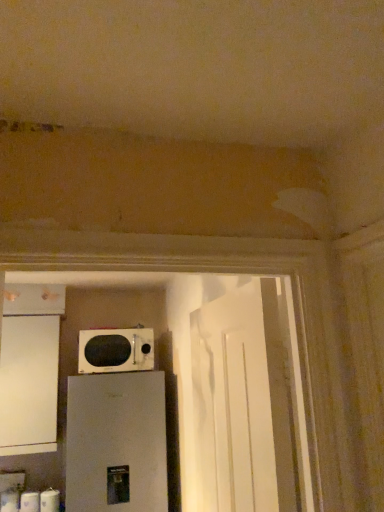
Question: Is white glossy microwave at center facing towards white matte toilet paper at lower left, which is the second toilet paper in left-to-right order?

Choices:
 (A) no
 (B) yes

Answer: (A)

Question: Does white glossy microwave at center have a lesser width compared to white matte toilet paper at lower left, the 2th toilet paper in the right-to-left sequence?

Choices:
 (A) yes
 (B) no

Answer: (B)

Question: Is white matte toilet paper at lower left, which is the second toilet paper in left-to-right order, a part of white glossy microwave at center?

Choices:
 (A) no
 (B) yes

Answer: (A)

Question: Does white glossy microwave at center have a greater width compared to white matte toilet paper at lower left, the 2th toilet paper in the right-to-left sequence?

Choices:
 (A) yes
 (B) no

Answer: (A)

Question: From the image's perspective, would you say white glossy microwave at center is shown under white matte toilet paper at lower left, the 2th toilet paper in the right-to-left sequence?

Choices:
 (A) yes
 (B) no

Answer: (B)

Question: From their relative heights in the image, would you say white matte toilet paper at lower left, which ranks as the third toilet paper in right-to-left order, is taller or shorter than white matte toilet paper at lower left, positioned as the 3th toilet paper in left-to-right order?

Choices:
 (A) tall
 (B) short

Answer: (A)

Question: Considering the positions of white matte toilet paper at lower left, which ranks as the third toilet paper in right-to-left order, and white matte toilet paper at lower left, positioned as the 3th toilet paper in left-to-right order, in the image, is white matte toilet paper at lower left, which ranks as the third toilet paper in right-to-left order, bigger or smaller than white matte toilet paper at lower left, positioned as the 3th toilet paper in left-to-right order,?

Choices:
 (A) small
 (B) big

Answer: (B)

Question: Considering the positions of white matte toilet paper at lower left, which ranks as the third toilet paper in right-to-left order, and white matte toilet paper at lower left, positioned as the 3th toilet paper in left-to-right order, in the image, is white matte toilet paper at lower left, which ranks as the third toilet paper in right-to-left order, wider or thinner than white matte toilet paper at lower left, positioned as the 3th toilet paper in left-to-right order,?

Choices:
 (A) thin
 (B) wide

Answer: (B)

Question: From a real-world perspective, is white matte toilet paper at lower left, which ranks as the third toilet paper in right-to-left order, positioned above or below white matte toilet paper at lower left, which is counted as the 1th toilet paper, starting from the right?

Choices:
 (A) above
 (B) below

Answer: (A)

Question: In the image, is white matte cabinet at left on the left side or the right side of white matte toilet paper at lower left, which is counted as the 1th toilet paper, starting from the left?

Choices:
 (A) left
 (B) right

Answer: (B)

Question: Is white matte cabinet at left wider or thinner than white matte toilet paper at lower left, which is counted as the 1th toilet paper, starting from the left?

Choices:
 (A) wide
 (B) thin

Answer: (A)

Question: Looking at the image, does white matte cabinet at left seem bigger or smaller compared to white matte toilet paper at lower left, which ranks as the third toilet paper in right-to-left order?

Choices:
 (A) big
 (B) small

Answer: (A)

Question: From the image's perspective, relative to white matte toilet paper at lower left, which is counted as the 1th toilet paper, starting from the left, is white matte cabinet at left above or below?

Choices:
 (A) below
 (B) above

Answer: (B)

Question: From the image's perspective, is white matte cabinet at left located above or below white glossy microwave at center?

Choices:
 (A) above
 (B) below

Answer: (B)

Question: In the image, is white matte cabinet at left on the left side or the right side of white glossy microwave at center?

Choices:
 (A) left
 (B) right

Answer: (A)